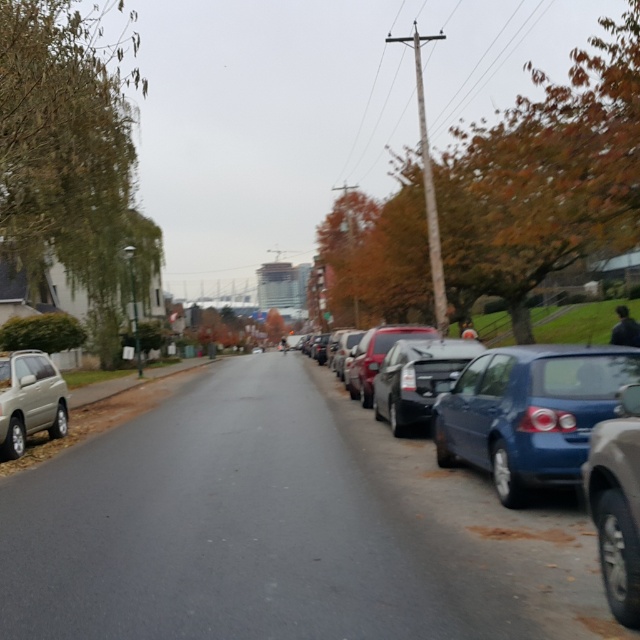
Can you confirm if metallic blue sedan at right is shorter than matte beige suv at lower left?

Indeed, metallic blue sedan at right has a lesser height compared to matte beige suv at lower left.

Is metallic blue sedan at right positioned in front of matte beige suv at lower left?

Yes, metallic blue sedan at right is in front of matte beige suv at lower left.

The height and width of the screenshot is (640, 640). Describe the element at coordinates (481, 531) in the screenshot. I see `metallic blue sedan at right` at that location.

Locate an element on the screen. metallic blue sedan at right is located at coordinates (481, 531).

Does metallic blue sedan at right have a greater height compared to satin black sedan at right?

Yes, metallic blue sedan at right is taller than satin black sedan at right.

Does metallic blue sedan at right appear on the left side of satin black sedan at right?

Indeed, metallic blue sedan at right is positioned on the left side of satin black sedan at right.

You are a GUI agent. You are given a task and a screenshot of the screen. Output one action in this format:
    pyautogui.click(x=<x>, y=<y>)
    Task: Click on the metallic blue sedan at right
    The height and width of the screenshot is (640, 640).
    Given the screenshot: What is the action you would take?
    pyautogui.click(x=481, y=531)

Which of these two, satin black sedan at right or matte beige suv at lower left, stands taller?

Standing taller between the two is matte beige suv at lower left.

Is point (378, 380) positioned after point (61, 436)?

That is False.

What do you see at coordinates (417, 378) in the screenshot? I see `satin black sedan at right` at bounding box center [417, 378].

Locate an element on the screen. The height and width of the screenshot is (640, 640). satin black sedan at right is located at coordinates (417, 378).